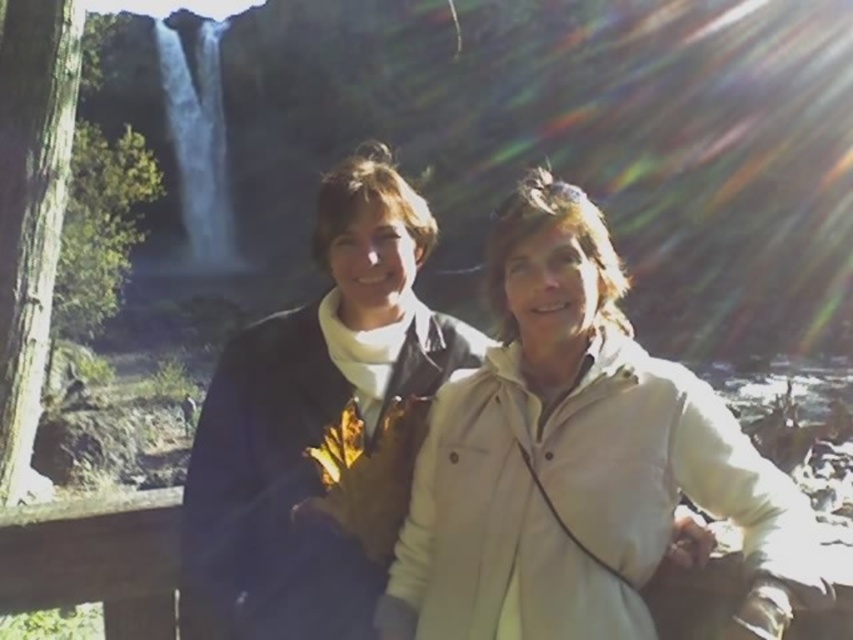
Question: Can you confirm if dark blue jacket at center is bigger than white smooth water at upper left?

Choices:
 (A) no
 (B) yes

Answer: (B)

Question: Does wooden rail at center have a lesser width compared to white smooth water at upper left?

Choices:
 (A) yes
 (B) no

Answer: (A)

Question: Which point appears farthest from the camera in this image?

Choices:
 (A) (335, 177)
 (B) (706, 406)
 (C) (180, 115)
 (D) (27, 531)

Answer: (C)

Question: Among these points, which one is nearest to the camera?

Choices:
 (A) (685, 582)
 (B) (695, 500)
 (C) (346, 256)

Answer: (A)

Question: Does wooden rail at center have a lesser width compared to white smooth water at upper left?

Choices:
 (A) no
 (B) yes

Answer: (B)

Question: Which point is farther to the camera?

Choices:
 (A) dark blue jacket at center
 (B) white smooth water at upper left

Answer: (B)